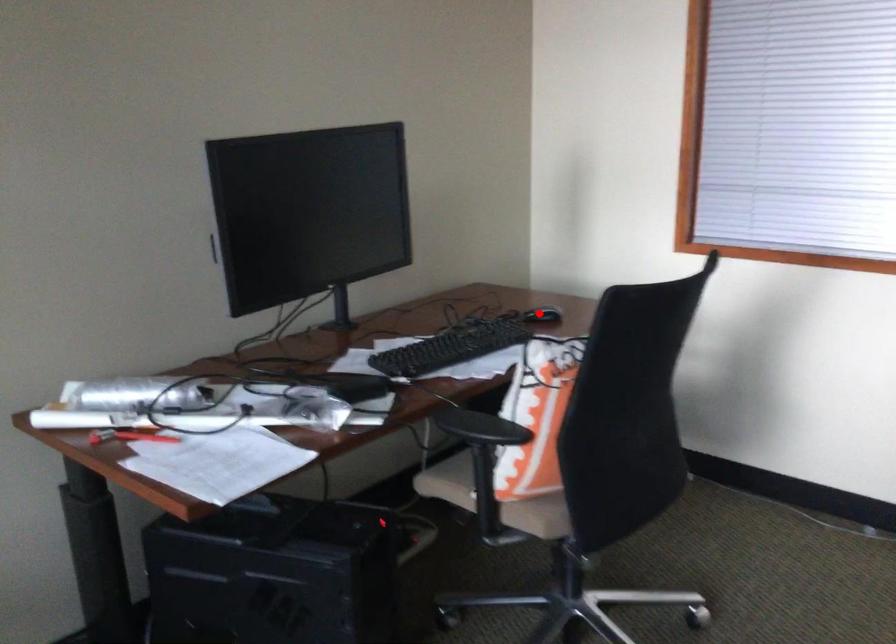
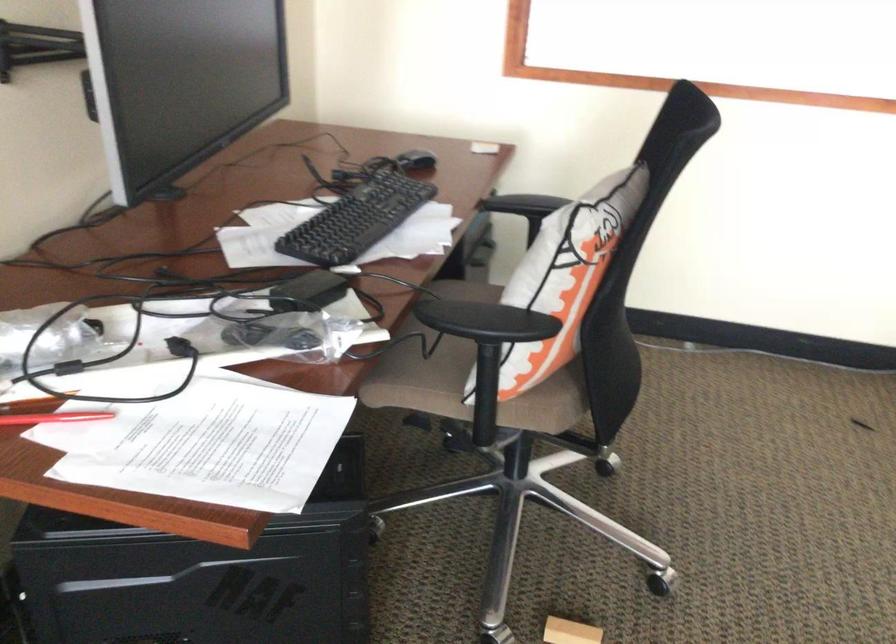
In the second image, find the point that corresponds to the highlighted location in the first image.

(416, 162)